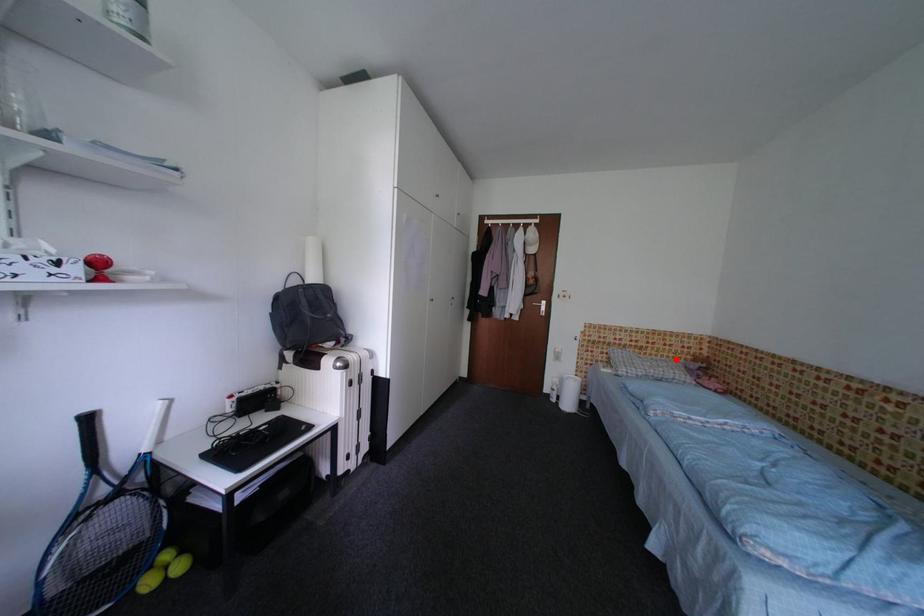
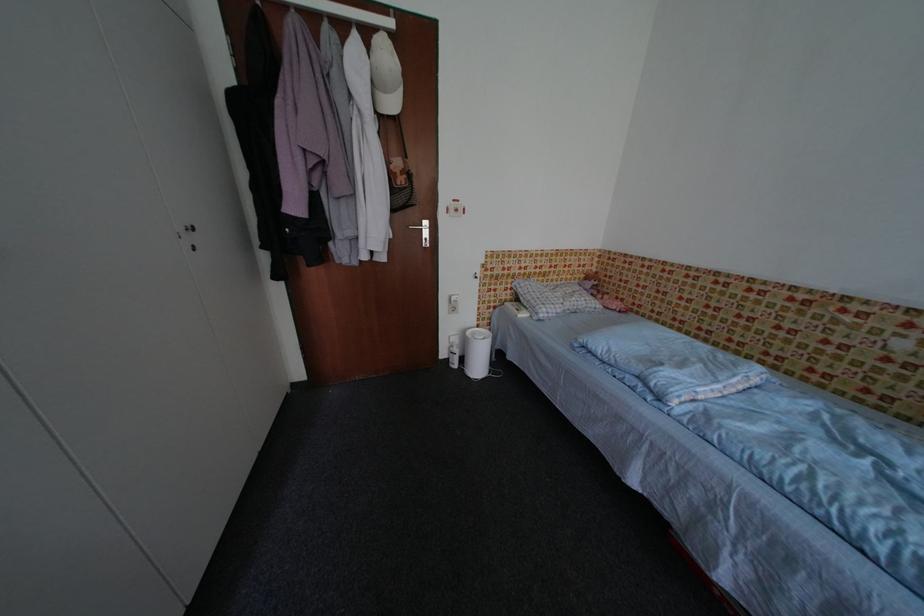
In the second image, find the point that corresponds to the highlighted location in the first image.

(574, 282)